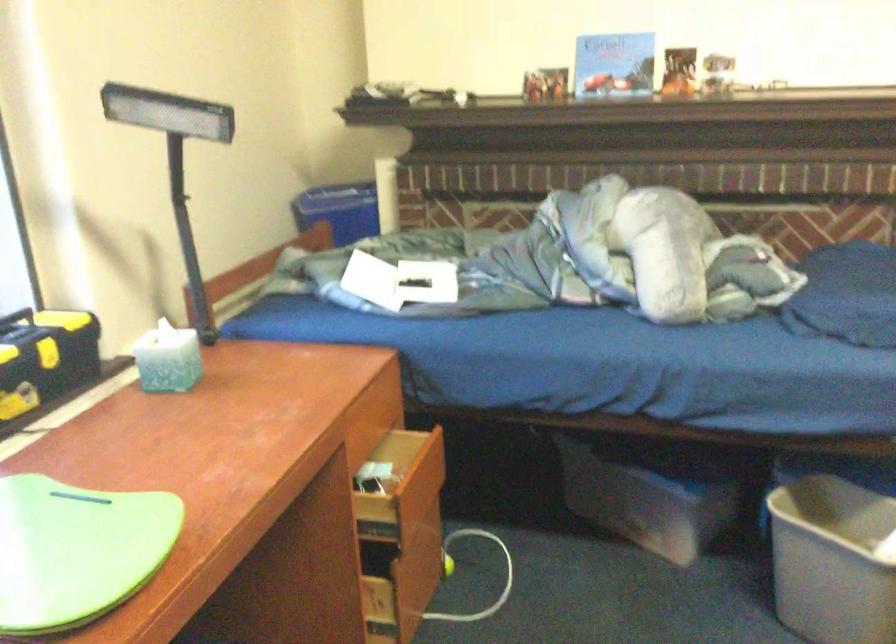
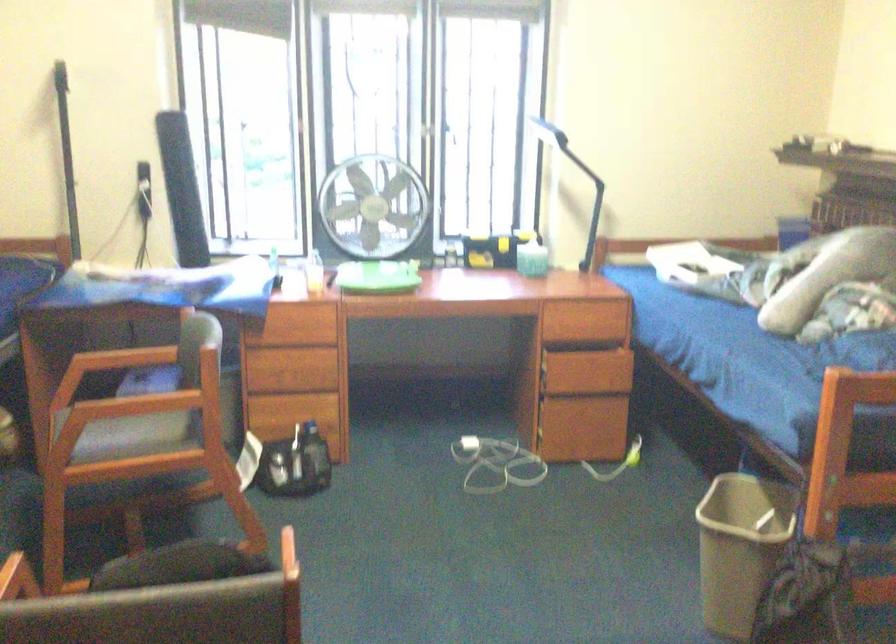
Where in the second image is the point corresponding to point (426, 489) from the first image?

(601, 375)